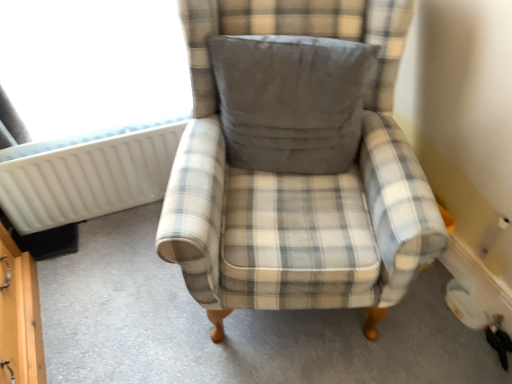
Question: Is gray fabric pillow at center closer to camera compared to transparent plastic radiator at upper left?

Choices:
 (A) no
 (B) yes

Answer: (B)

Question: Can you confirm if gray fabric pillow at center is bigger than transparent plastic radiator at upper left?

Choices:
 (A) yes
 (B) no

Answer: (B)

Question: From the image's perspective, would you say gray fabric pillow at center is positioned over transparent plastic radiator at upper left?

Choices:
 (A) yes
 (B) no

Answer: (B)

Question: Is gray fabric pillow at center positioned with its back to transparent plastic radiator at upper left?

Choices:
 (A) no
 (B) yes

Answer: (A)

Question: Is gray fabric pillow at center shorter than transparent plastic radiator at upper left?

Choices:
 (A) no
 (B) yes

Answer: (B)

Question: In terms of size, does plaid fabric armchair at center appear bigger or smaller than white plastic radiator at left?

Choices:
 (A) big
 (B) small

Answer: (A)

Question: Is point (398, 286) positioned closer to the camera than point (49, 155)?

Choices:
 (A) closer
 (B) farther

Answer: (A)

Question: From a real-world perspective, relative to white plastic radiator at left, is plaid fabric armchair at center vertically above or below?

Choices:
 (A) above
 (B) below

Answer: (A)

Question: From the image's perspective, is plaid fabric armchair at center positioned above or below white plastic radiator at left?

Choices:
 (A) above
 (B) below

Answer: (B)

Question: Would you say white plastic radiator at left is inside or outside plaid fabric armchair at center?

Choices:
 (A) inside
 (B) outside

Answer: (B)

Question: From a real-world perspective, relative to plaid fabric armchair at center, is white plastic radiator at left vertically above or below?

Choices:
 (A) above
 (B) below

Answer: (B)

Question: Is white plastic radiator at left taller or shorter than plaid fabric armchair at center?

Choices:
 (A) tall
 (B) short

Answer: (B)

Question: From the image's perspective, is white plastic radiator at left positioned above or below plaid fabric armchair at center?

Choices:
 (A) below
 (B) above

Answer: (B)

Question: From a real-world perspective, is white plastic radiator at left positioned above or below transparent plastic radiator at upper left?

Choices:
 (A) below
 (B) above

Answer: (A)

Question: From the image's perspective, is white plastic radiator at left located above or below transparent plastic radiator at upper left?

Choices:
 (A) above
 (B) below

Answer: (B)